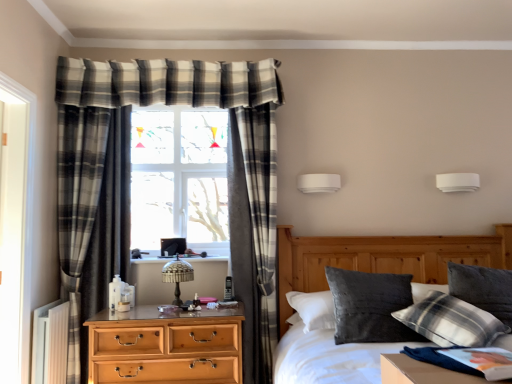
Question: From the image's perspective, is light brown wooden chest of drawers at center left above white glossy screen door at left?

Choices:
 (A) yes
 (B) no

Answer: (B)

Question: Is light brown wooden chest of drawers at center left bigger than white glossy screen door at left?

Choices:
 (A) yes
 (B) no

Answer: (A)

Question: Considering the relative sizes of light brown wooden chest of drawers at center left and white glossy screen door at left in the image provided, is light brown wooden chest of drawers at center left wider than white glossy screen door at left?

Choices:
 (A) yes
 (B) no

Answer: (A)

Question: Can you confirm if light brown wooden chest of drawers at center left is positioned to the left of white glossy screen door at left?

Choices:
 (A) no
 (B) yes

Answer: (A)

Question: Is the surface of light brown wooden chest of drawers at center left in direct contact with white glossy screen door at left?

Choices:
 (A) no
 (B) yes

Answer: (A)

Question: From a real-world perspective, is light brown wooden chest of drawers at center left on top of white glossy screen door at left?

Choices:
 (A) no
 (B) yes

Answer: (A)

Question: Is white plastic radiator at lower left shorter than translucent glass table lamp at center?

Choices:
 (A) yes
 (B) no

Answer: (B)

Question: Is translucent glass table lamp at center a part of white plastic radiator at lower left?

Choices:
 (A) no
 (B) yes

Answer: (A)

Question: Does white plastic radiator at lower left have a lesser width compared to translucent glass table lamp at center?

Choices:
 (A) yes
 (B) no

Answer: (A)

Question: From a real-world perspective, does white plastic radiator at lower left stand above translucent glass table lamp at center?

Choices:
 (A) no
 (B) yes

Answer: (A)

Question: Does white plastic radiator at lower left have a greater width compared to translucent glass table lamp at center?

Choices:
 (A) no
 (B) yes

Answer: (A)

Question: From a real-world perspective, does white plastic radiator at lower left sit lower than translucent glass table lamp at center?

Choices:
 (A) yes
 (B) no

Answer: (A)

Question: Is plaid fabric pillow at upper right, the 2th pillow viewed from the left, turned away from velvet grey pillow at center?

Choices:
 (A) yes
 (B) no

Answer: (A)